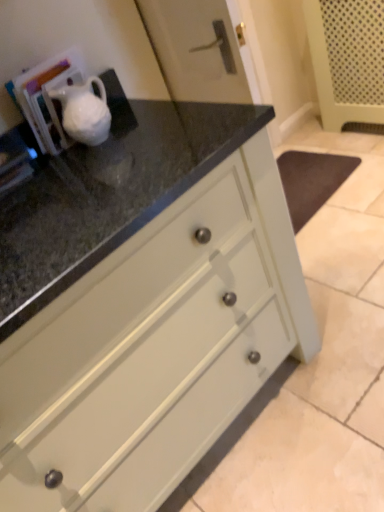
Question: Should I look upward or downward to see white matte cabinet at center?

Choices:
 (A) up
 (B) down

Answer: (B)